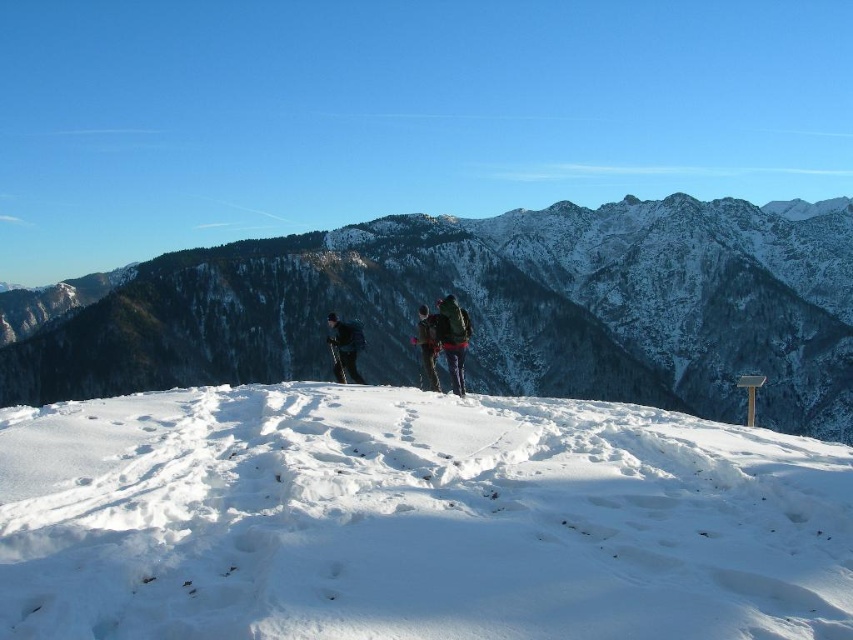
Which is behind, point (86, 307) or point (430, 360)?

Positioned behind is point (86, 307).

Image resolution: width=853 pixels, height=640 pixels. What do you see at coordinates (497, 308) in the screenshot?
I see `snowy rocky mountain at center` at bounding box center [497, 308].

I want to click on snowy rocky mountain at center, so click(497, 308).

Does snowy rocky mountain at center lie in front of black fabric jacket at center?

No, it is not.

Between point (622, 272) and point (329, 324), which one is positioned behind?

The point (622, 272) is more distant.

Where is `snowy rocky mountain at center`? snowy rocky mountain at center is located at coordinates (497, 308).

I want to click on snowy rocky mountain at center, so click(497, 308).

Can you confirm if black fabric jacket at center is bigger than dark gray fabric jacket at center?

Yes, black fabric jacket at center is bigger than dark gray fabric jacket at center.

Is point (351, 369) positioned after point (425, 310)?

No, (351, 369) is closer to viewer.

What do you see at coordinates (344, 348) in the screenshot?
I see `black fabric jacket at center` at bounding box center [344, 348].

At what (x,y) coordinates should I click in order to perform the action: click on black fabric jacket at center. Please return your answer as a coordinate pair (x, y). Looking at the image, I should click on (344, 348).